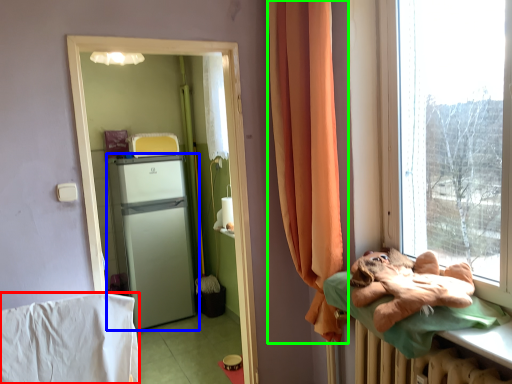
Question: Considering the real-world distances, which object is farthest from blanket (highlighted by a red box)? refrigerator (highlighted by a blue box) or curtain (highlighted by a green box)?

Choices:
 (A) refrigerator
 (B) curtain

Answer: (A)